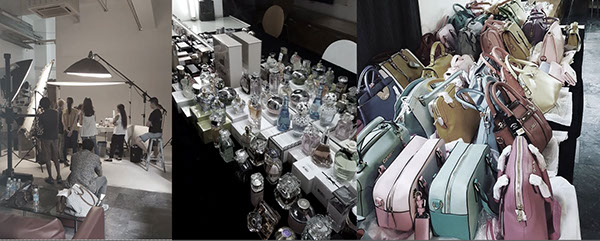
Find the location of `light stands`. light stands is located at coordinates (129, 102), (143, 110), (163, 115).